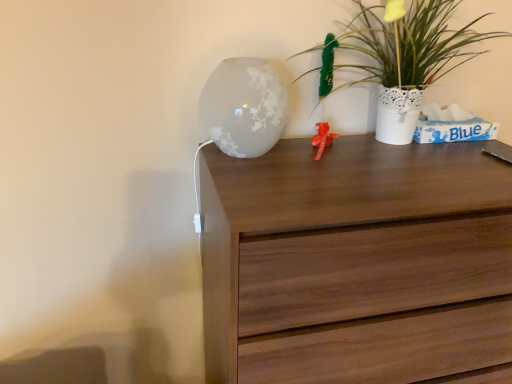
Locate an element on the screen. This screenshot has height=384, width=512. free space to the right of frosted glass vase at upper center is located at coordinates (338, 169).